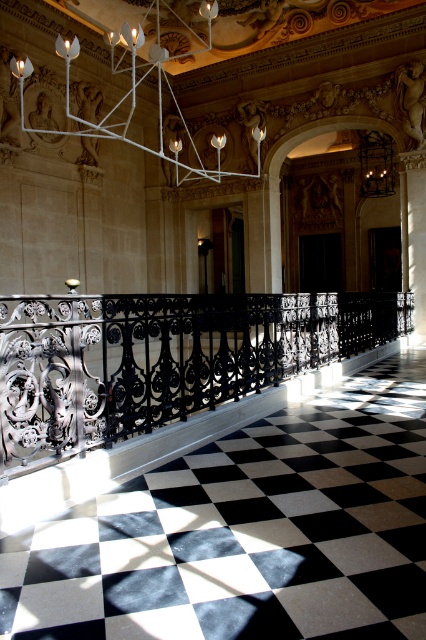
Does point (48, 298) come farther from viewer compared to point (161, 52)?

No, (48, 298) is closer to viewer.

Does black wrought iron railing at center have a lesser width compared to white metal chandelier at upper center?

In fact, black wrought iron railing at center might be wider than white metal chandelier at upper center.

Where is `black wrought iron railing at center`? The image size is (426, 640). black wrought iron railing at center is located at coordinates (163, 358).

At what (x,y) coordinates should I click in order to perform the action: click on black wrought iron railing at center. Please return your answer as a coordinate pair (x, y). The width and height of the screenshot is (426, 640). Looking at the image, I should click on tap(163, 358).